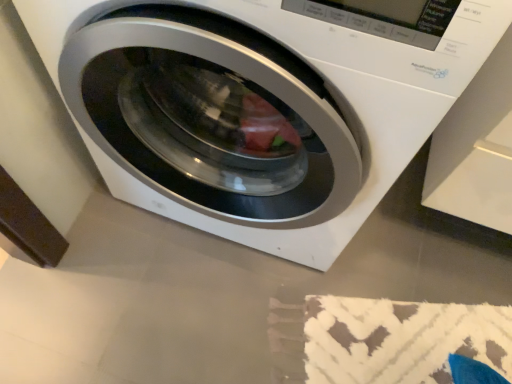
Find the location of a particular element. space that is in front of white glossy washing machine at center is located at coordinates (217, 311).